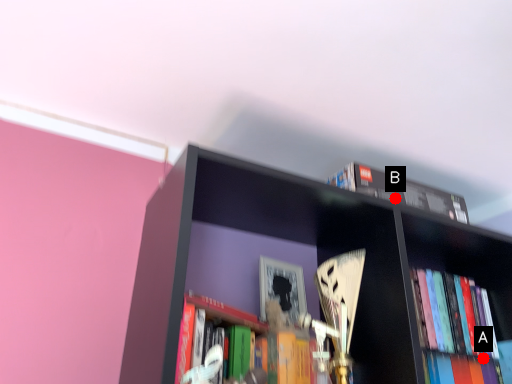
Question: Two points are circled on the image, labeled by A and B beside each circle. Which point is farther from the camera taking this photo?

Choices:
 (A) A is further
 (B) B is further

Answer: (A)